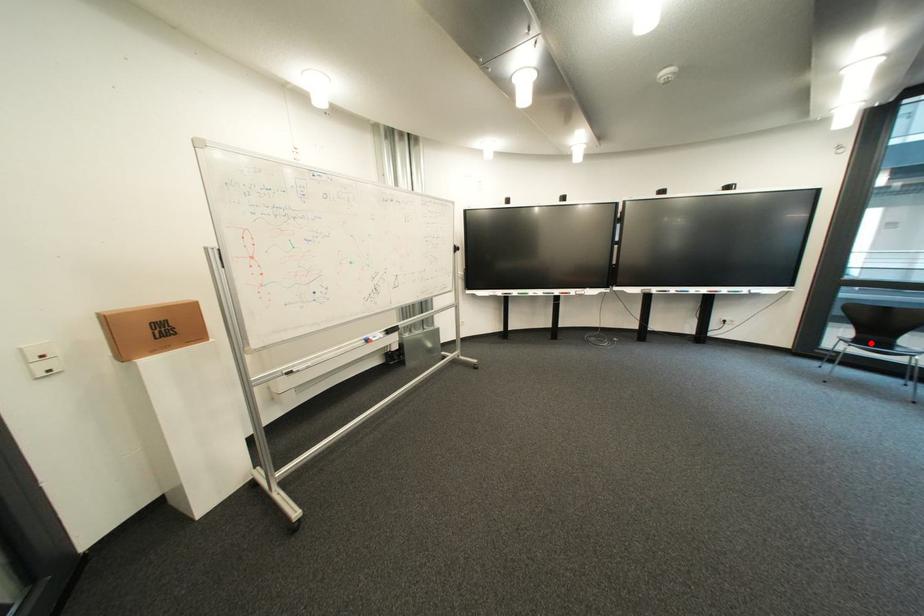
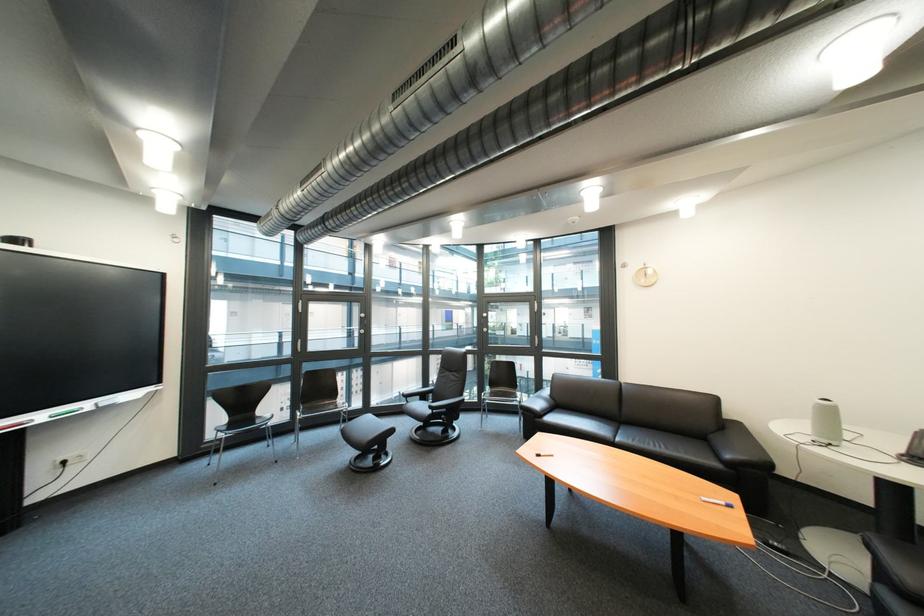
Where in the second image is the point corresponding to the highlighted location from the first image?

(246, 426)